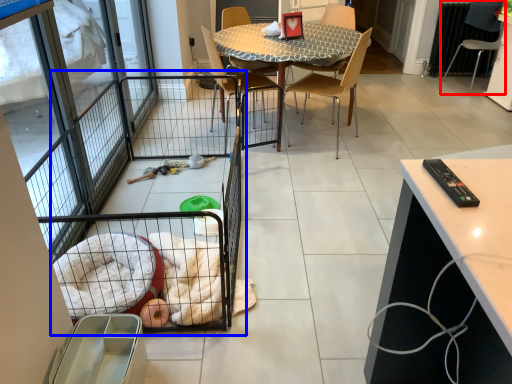
Question: Which of the following is the closest to the observer, chair (highlighted by a red box) or balcony (highlighted by a blue box)?

Choices:
 (A) chair
 (B) balcony

Answer: (B)